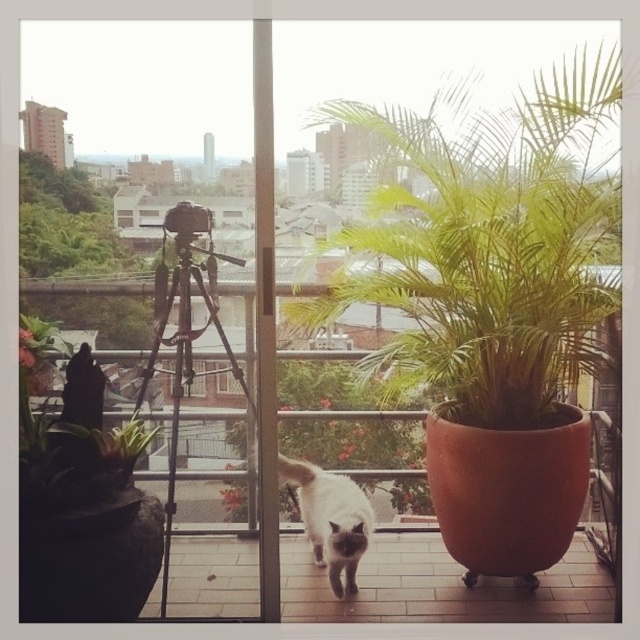
Between point (349, 465) and point (138, 428), which one is positioned behind?

The point (349, 465) is behind.

Does green leafy plant at center have a lesser width compared to green matte plant at left?

No.

Which is in front, point (374, 403) or point (26, 344)?

Point (26, 344) is more forward.

At what (x,y) coordinates should I click in order to perform the action: click on green leafy plant at center. Please return your answer as a coordinate pair (x, y). The image size is (640, 640). Looking at the image, I should click on (355, 442).

Can you confirm if green leafy plant at center is wider than white fur cat at center?

Correct, the width of green leafy plant at center exceeds that of white fur cat at center.

Who is more forward, [285,435] or [340,513]?

Point [340,513]

What do you see at coordinates (355, 442) in the screenshot? The width and height of the screenshot is (640, 640). I see `green leafy plant at center` at bounding box center [355, 442].

This screenshot has width=640, height=640. Identify the location of green leafy plant at center. (355, 442).

The width and height of the screenshot is (640, 640). Find the location of `green leafy plant at upper right`. green leafy plant at upper right is located at coordinates (490, 244).

In the scene shown: Is green leafy plant at upper right further to the viewer compared to green leafy plant at center?

No.

Where is `green leafy plant at upper right`? The height and width of the screenshot is (640, 640). green leafy plant at upper right is located at coordinates (490, 244).